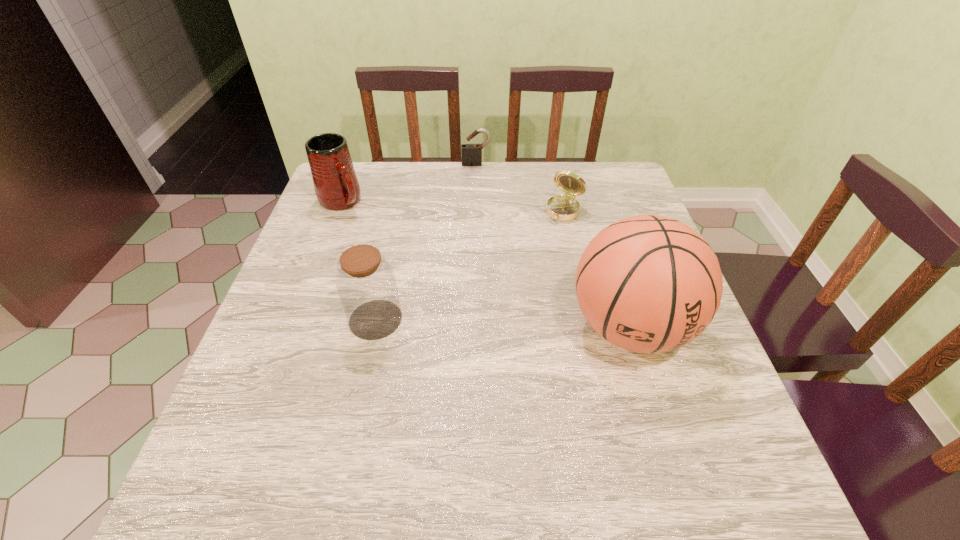
Where is `free spot between the tallest object and the padlock`? free spot between the tallest object and the padlock is located at coordinates (553, 245).

The image size is (960, 540). In order to click on free spot between the third object from right to left and the basketball in this screenshot , I will do `click(553, 245)`.

Image resolution: width=960 pixels, height=540 pixels. I want to click on unoccupied position between the farthest object and the compass, so click(x=520, y=188).

The height and width of the screenshot is (540, 960). I want to click on empty space between the mug and the compass, so click(x=453, y=206).

Image resolution: width=960 pixels, height=540 pixels. What are the coordinates of `vacant space that's between the tallest object and the mug` in the screenshot? It's located at (486, 264).

Identify the location of blank region between the fourth object from right to left and the third object from right to left. The image size is (960, 540). (426, 241).

Locate an element on the screen. The width and height of the screenshot is (960, 540). empty space between the second object from left to right and the tallest object is located at coordinates 502,323.

Identify the location of vacant area that lies between the compass and the fourth object from right to left. (469, 265).

Image resolution: width=960 pixels, height=540 pixels. Find the location of `free space between the third object from right to left and the jar`. free space between the third object from right to left and the jar is located at coordinates coord(426,241).

I want to click on the fourth closest object to the basketball, so click(336, 185).